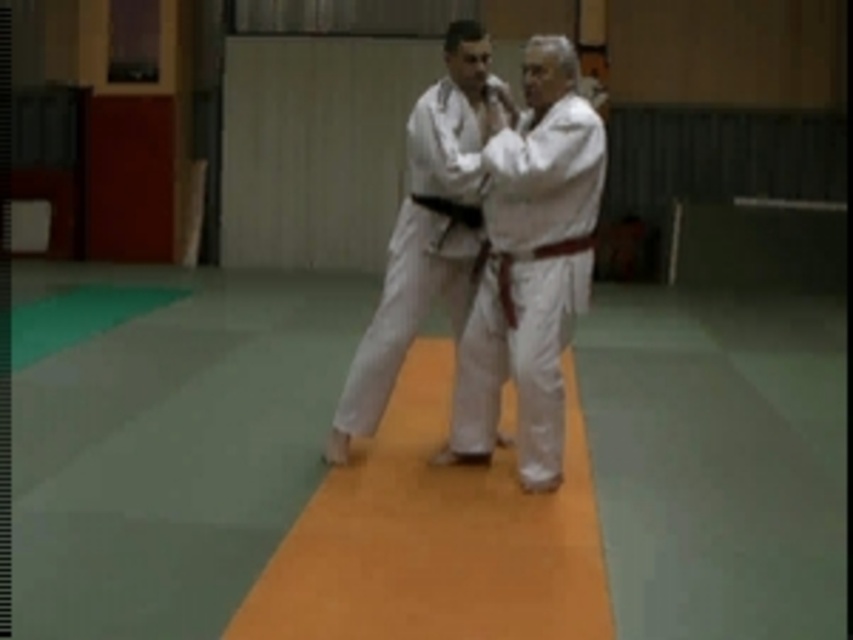
Is point (502, 168) more distant than point (456, 92)?

No, it is in front of (456, 92).

Between point (561, 410) and point (434, 282), which one is positioned behind?

The point (434, 282) is behind.

What do you see at coordinates (529, 260) in the screenshot? This screenshot has height=640, width=853. I see `white matte kimono at center` at bounding box center [529, 260].

The height and width of the screenshot is (640, 853). What are the coordinates of `white matte kimono at center` in the screenshot? It's located at (529, 260).

Is point (416, 166) positioned after point (440, 212)?

Yes.

Between white karate gi at center and black leather belt at center, which one has more height?

With more height is white karate gi at center.

Where is `white karate gi at center`? This screenshot has width=853, height=640. white karate gi at center is located at coordinates (421, 241).

From the picture: Measure the distance between white matte kimono at center and camera.

white matte kimono at center is 18.02 feet from camera.

Find the location of a particular element. Image resolution: width=853 pixels, height=640 pixels. white matte kimono at center is located at coordinates (529, 260).